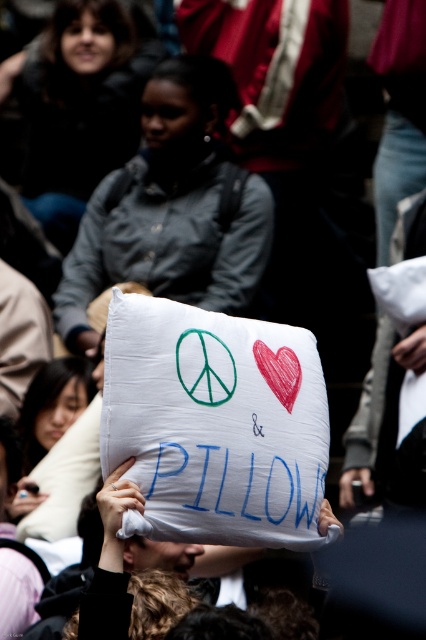
Question: Can you confirm if gray fabric pillow at center is positioned to the right of dark gray jacket at upper left?

Choices:
 (A) no
 (B) yes

Answer: (B)

Question: Can you confirm if dark gray jacket at upper left is smaller than red paper heart at center?

Choices:
 (A) yes
 (B) no

Answer: (B)

Question: Which point appears closest to the camera in this image?

Choices:
 (A) (71, 518)
 (B) (49, 374)
 (C) (152, 148)
 (D) (120, 74)

Answer: (A)

Question: Observing the image, what is the correct spatial positioning of gray fabric pillow at center in reference to white fabric pillow at lower center?

Choices:
 (A) right
 (B) left

Answer: (A)

Question: Which of the following is the farthest from the observer?

Choices:
 (A) white fabric pillow at lower center
 (B) dark gray jacket at upper left

Answer: (B)

Question: Among these objects, which one is nearest to the camera?

Choices:
 (A) white soft pillow at center
 (B) dark gray jacket at upper left
 (C) white fabric pillow at lower center
 (D) gray fabric pillow at center

Answer: (A)